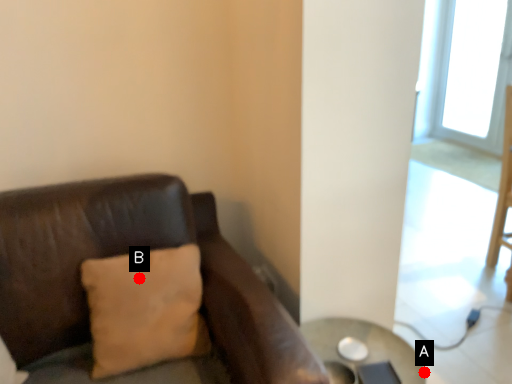
Question: Two points are circled on the image, labeled by A and B beside each circle. Which point is closer to the camera?

Choices:
 (A) A is closer
 (B) B is closer

Answer: (B)